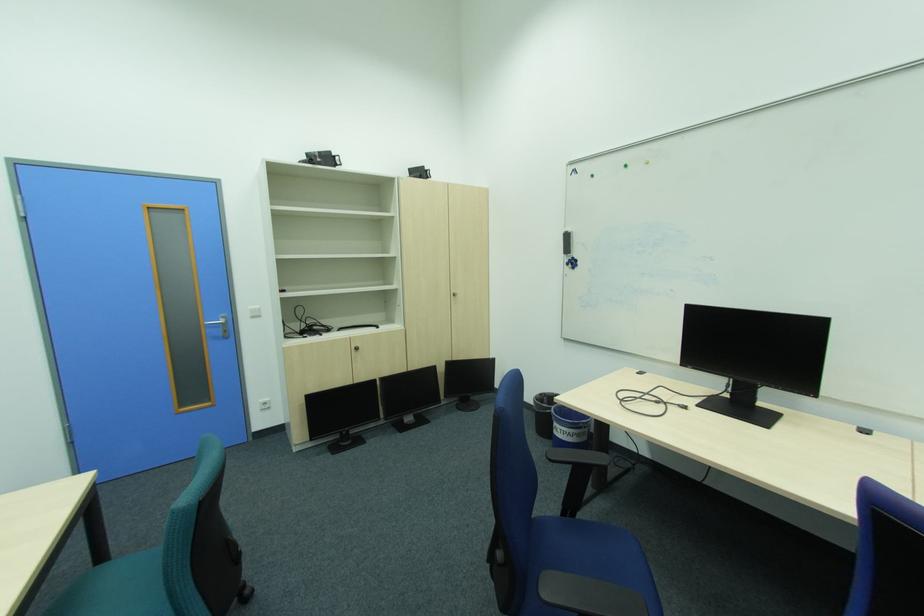
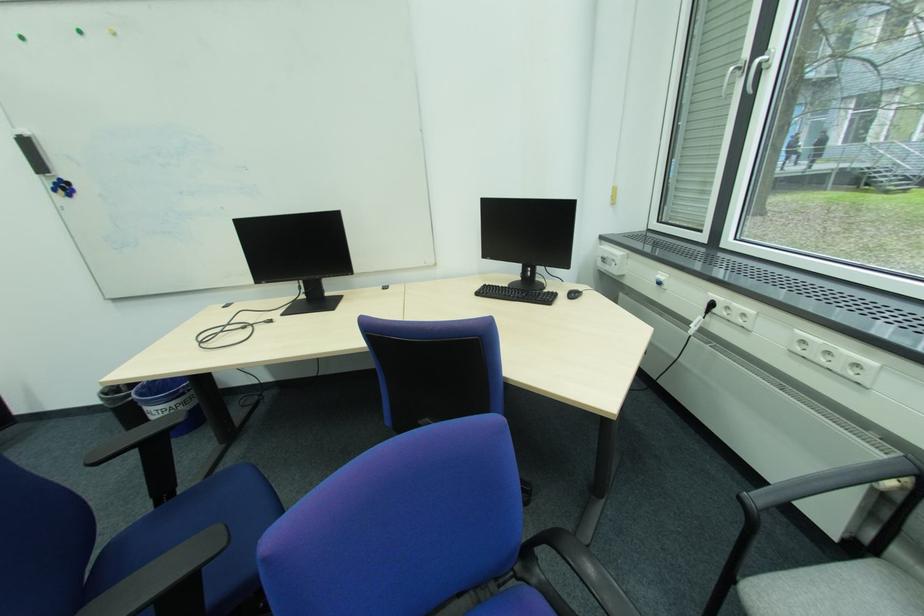
In the second image, find the point that corresponds to the point at 561,419 in the first image.

(149, 403)